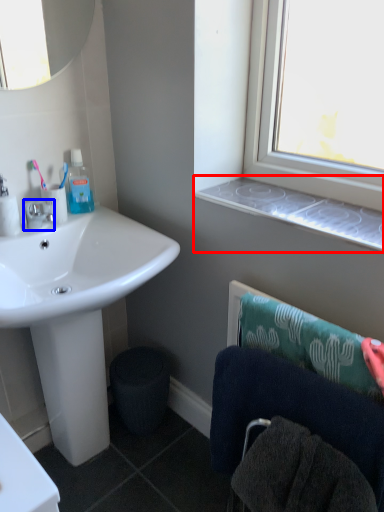
Question: Which object is closer to the camera taking this photo, window sill (highlighted by a red box) or tap (highlighted by a blue box)?

Choices:
 (A) window sill
 (B) tap

Answer: (A)